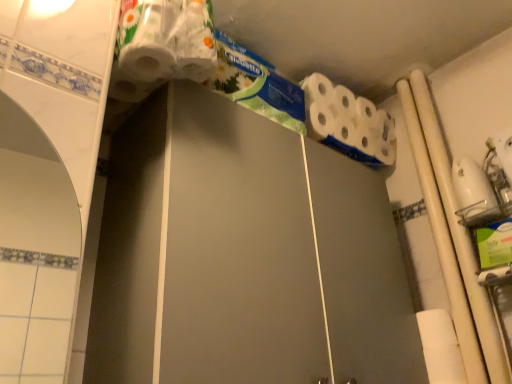
Question: Could you tell me if green floral toothpaste at upper center is facing white matte toilet paper at upper right?

Choices:
 (A) yes
 (B) no

Answer: (B)

Question: Does green floral toothpaste at upper center have a larger size compared to white matte toilet paper at upper right?

Choices:
 (A) no
 (B) yes

Answer: (A)

Question: From a real-world perspective, is green floral toothpaste at upper center on white matte toilet paper at upper right?

Choices:
 (A) no
 (B) yes

Answer: (A)

Question: Is white matte toilet paper at upper right located within green floral toothpaste at upper center?

Choices:
 (A) no
 (B) yes

Answer: (A)

Question: Is the depth of green floral toothpaste at upper center less than that of white matte toilet paper at upper right?

Choices:
 (A) no
 (B) yes

Answer: (B)

Question: Does green floral toothpaste at upper center come behind white matte toilet paper at upper right?

Choices:
 (A) no
 (B) yes

Answer: (A)

Question: Does white matte toilet paper at upper right have a smaller size compared to green floral toothpaste at upper center?

Choices:
 (A) no
 (B) yes

Answer: (A)

Question: Considering the relative positions of white matte toilet paper at upper right and green floral toothpaste at upper center in the image provided, is white matte toilet paper at upper right to the left of green floral toothpaste at upper center from the viewer's perspective?

Choices:
 (A) yes
 (B) no

Answer: (B)

Question: Is white matte toilet paper at upper right not within green floral toothpaste at upper center?

Choices:
 (A) yes
 (B) no

Answer: (A)

Question: Does white matte toilet paper at upper right have a greater width compared to green floral toothpaste at upper center?

Choices:
 (A) no
 (B) yes

Answer: (B)

Question: Would you say green floral toothpaste at upper center is part of white matte toilet paper at upper right's contents?

Choices:
 (A) yes
 (B) no

Answer: (B)

Question: Could you tell me if white matte toilet paper at upper right is facing green floral toothpaste at upper center?

Choices:
 (A) no
 (B) yes

Answer: (A)

Question: Does point (365, 140) appear closer or farther from the camera than point (285, 102)?

Choices:
 (A) farther
 (B) closer

Answer: (A)